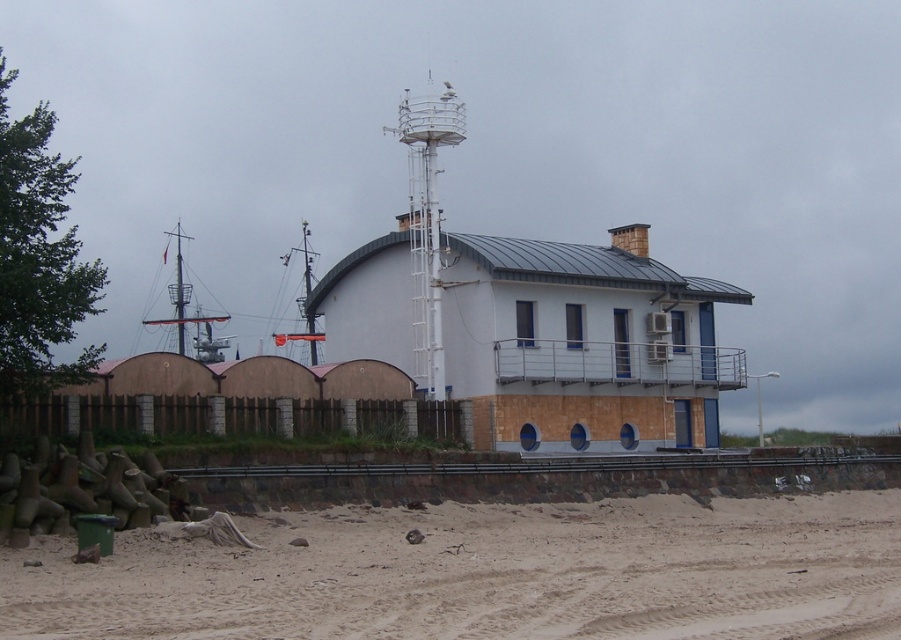
You are standing at the origin point of the image. Which direction should you move to reach the white painted wood hut at center?

The white painted wood hut at center is located at coordinates point (584, 342), so you should move towards the center of the image to reach it.

You are a delivery person arriving at the coastal building. You need to unload a heavy crate from your truck parked on the sandy beach. The crate must be placed on a stable surface. Based on the scene, which object between the brown sandy dirt at lower center and the white painted wood hut at center would be more suitable for placing the crate?

The white painted wood hut at center is more suitable for placing the crate since the brown sandy dirt at lower center has a lesser height, making it potentially less stable compared to the elevated hut surface.